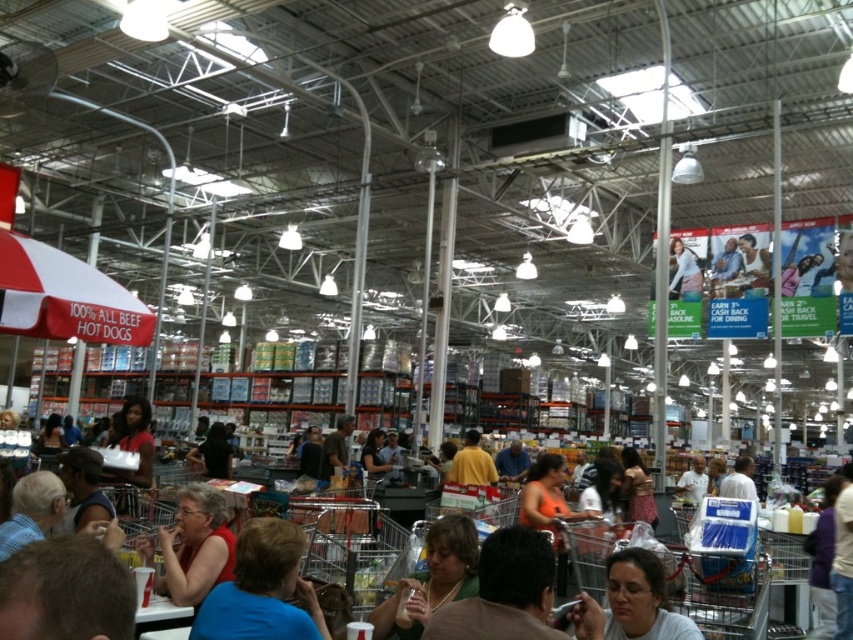
You are standing at the entrance of the store and want to go to the point marked as point (601, 636). If your walking speed is 3 feet per second, how many seconds will it take you to reach there?

The distance between you and point (601, 636) is 43.62 feet. At a walking speed of 3 feet per second, it will take approximately 14.54 seconds to reach the point.

You are a store employee who needs to place a large box on a shelf. You see the matte red shirt at lower left and the orange fabric shirt at center. Which shirt is wider?

The matte red shirt at lower left might be wider than orange fabric shirt at center according to the description.

Based on the photo, you are looking at the center of the image and see a brown leather jacket at center and an orange fabric shirt at center. Which one is positioned to the right side?

The brown leather jacket at center is positioned to the right of the orange fabric shirt at center.